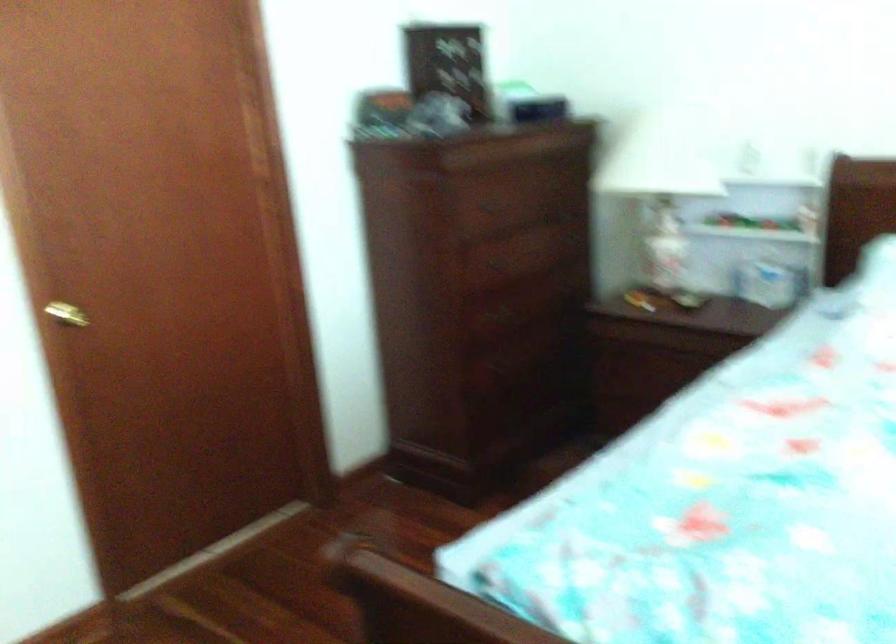
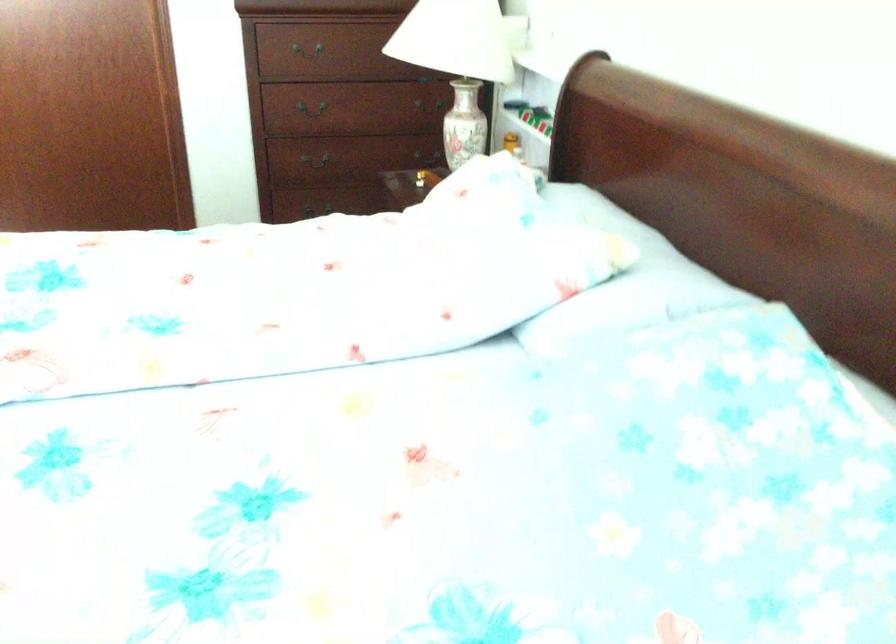
Find the pixel in the second image that matches point (442, 207) in the first image.

(309, 52)